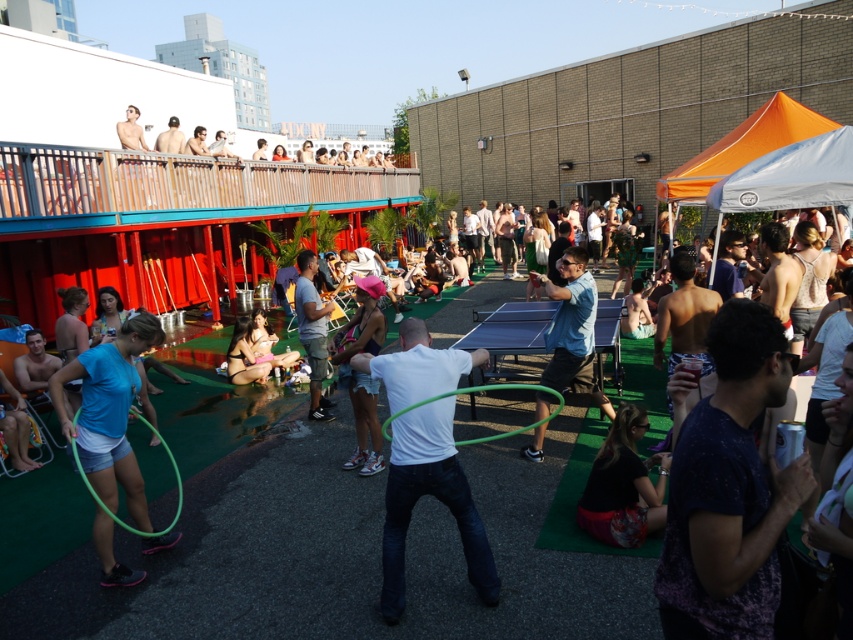
Question: Which of the following is the farthest from the observer?

Choices:
 (A) pink fabric hat at center
 (B) blue fabric hula hoop at center-left
 (C) green rubber hula hoop at center

Answer: (C)

Question: From the image, what is the correct spatial relationship of purple speckled shirt at center-right in relation to dark blue fabric at lower right?

Choices:
 (A) left
 (B) right

Answer: (A)

Question: Which of the following is the closest to the observer?

Choices:
 (A) (785, 124)
 (B) (403, 440)

Answer: (B)

Question: Which of the following is the closest to the observer?

Choices:
 (A) orange fabric canopy at upper right
 (B) dark blue fabric at lower right

Answer: (B)

Question: Is light blue t-shirt at center smaller than green rubber hula hoop at center?

Choices:
 (A) yes
 (B) no

Answer: (B)

Question: Does dark blue fabric at lower right have a smaller size compared to light blue t-shirt at center?

Choices:
 (A) yes
 (B) no

Answer: (A)